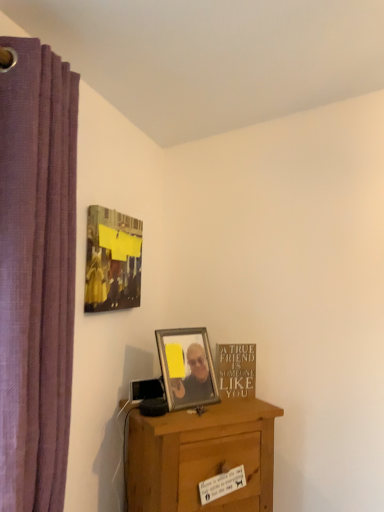
Question: Should I look upward or downward to see matte black picture frame at upper left, which is the 1th picture frame in left-to-right order?

Choices:
 (A) down
 (B) up

Answer: (A)

Question: Is metallic silver picture frame at center, which appears as the first picture frame when viewed from the right, shorter than matte black picture frame at upper left, the second picture frame from the right?

Choices:
 (A) no
 (B) yes

Answer: (B)

Question: Is matte black picture frame at upper left, placed as the first picture frame when sorted from top to bottom, at the back of metallic silver picture frame at center, the first picture frame when ordered from bottom to top?

Choices:
 (A) no
 (B) yes

Answer: (A)

Question: Is metallic silver picture frame at center, which appears as the first picture frame when viewed from the right, closer to camera compared to matte black picture frame at upper left, which is the 2th picture frame from bottom to top?

Choices:
 (A) yes
 (B) no

Answer: (B)

Question: Considering the relative sizes of metallic silver picture frame at center, acting as the 2th picture frame starting from the top, and matte black picture frame at upper left, the second picture frame from the right, in the image provided, is metallic silver picture frame at center, acting as the 2th picture frame starting from the top, wider than matte black picture frame at upper left, the second picture frame from the right,?

Choices:
 (A) yes
 (B) no

Answer: (A)

Question: Does metallic silver picture frame at center, which appears as the first picture frame when viewed from the right, appear on the left side of matte black picture frame at upper left, which is the 2th picture frame from bottom to top?

Choices:
 (A) no
 (B) yes

Answer: (A)

Question: Does metallic silver picture frame at center, which is the second picture frame from left to right, have a larger size compared to matte black picture frame at upper left, the second picture frame from the right?

Choices:
 (A) yes
 (B) no

Answer: (B)

Question: Does gold metallic sign at lower right have a lesser height compared to matte black picture frame at upper left, which is the 1th picture frame in left-to-right order?

Choices:
 (A) no
 (B) yes

Answer: (B)

Question: Can you confirm if gold metallic sign at lower right is positioned to the left of matte black picture frame at upper left, the second picture frame from the right?

Choices:
 (A) no
 (B) yes

Answer: (A)

Question: Can we say gold metallic sign at lower right lies outside matte black picture frame at upper left, which is the 1th picture frame in left-to-right order?

Choices:
 (A) no
 (B) yes

Answer: (B)

Question: Could you tell me if gold metallic sign at lower right is facing matte black picture frame at upper left, which is the 2th picture frame from bottom to top?

Choices:
 (A) yes
 (B) no

Answer: (B)

Question: Is gold metallic sign at lower right looking in the opposite direction of matte black picture frame at upper left, the second picture frame from the right?

Choices:
 (A) yes
 (B) no

Answer: (B)

Question: Does gold metallic sign at lower right have a greater width compared to matte black picture frame at upper left, which is the 2th picture frame from bottom to top?

Choices:
 (A) no
 (B) yes

Answer: (A)

Question: Can you confirm if metallic silver picture frame at center, the first picture frame when ordered from bottom to top, is bigger than gold metallic sign at lower right?

Choices:
 (A) yes
 (B) no

Answer: (A)